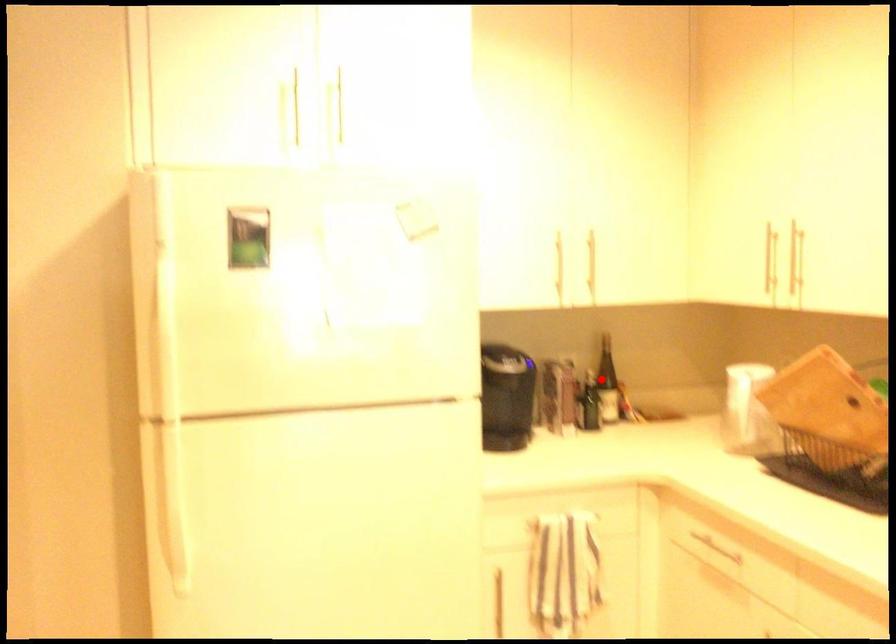
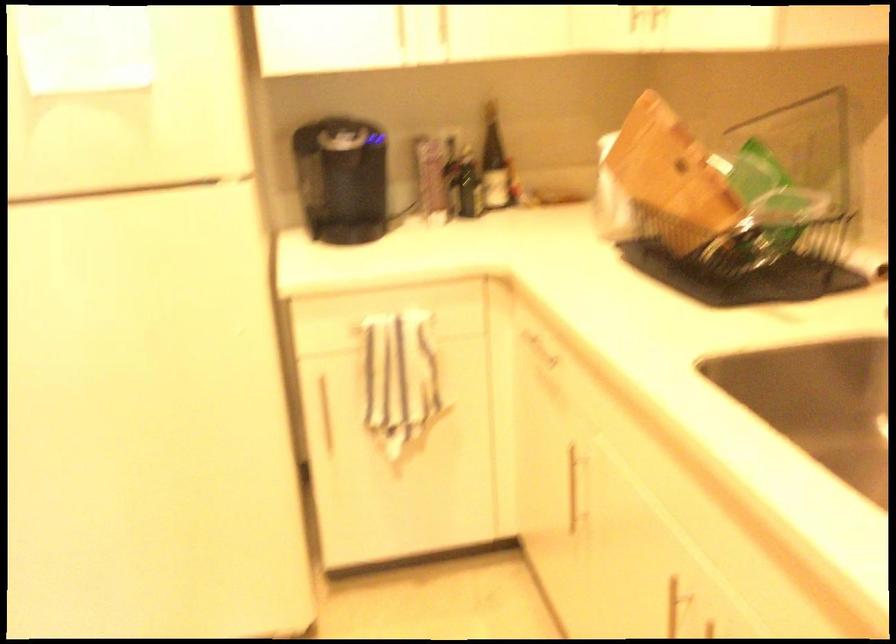
Question: I am providing you with two images of the same scene from different viewpoints. In image1, a red point is highlighted. Considering the same 3D point in image2, which of the following is correct?

Choices:
 (A) It is closer
 (B) It is farther

Answer: (A)